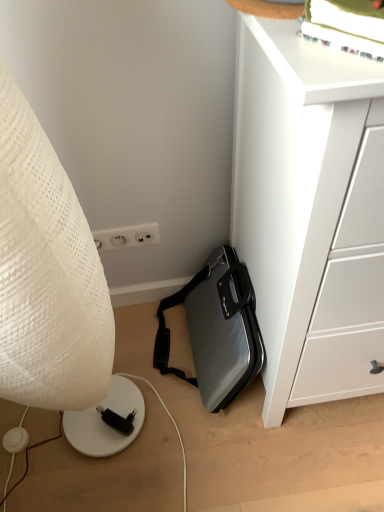
At what (x,y) coordinates should I click in order to perform the action: click on unoccupied region to the right of white textured lamp at left. Please return your answer as a coordinate pair (x, y). The width and height of the screenshot is (384, 512). Looking at the image, I should click on (189, 461).